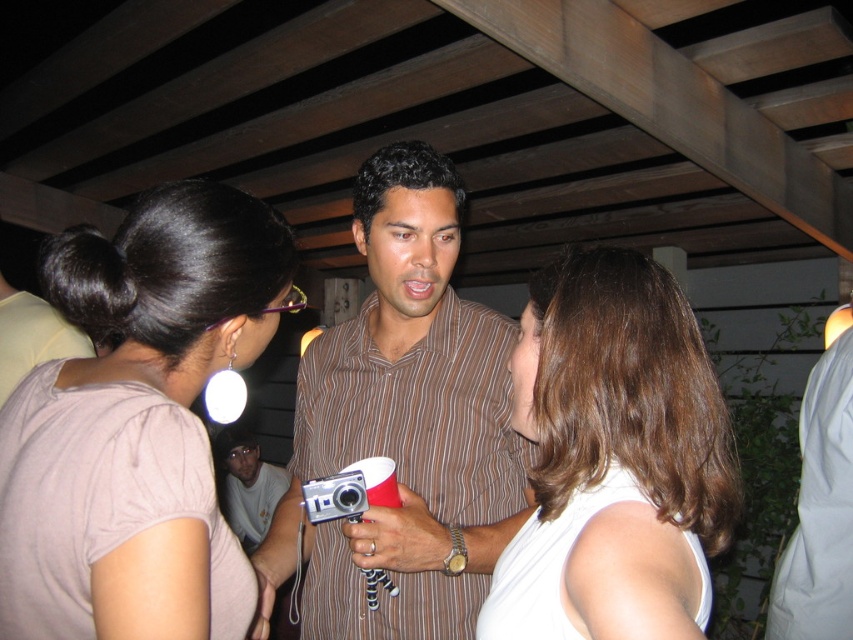
You are standing at the point labeled point (x=477, y=412) and want to move to the point labeled point (x=231, y=515). Given that you can only move in a straight line, will you be moving away from or towards the camera?

Since point (x=477, y=412) is closer to the camera than point (x=231, y=515), moving from point (x=477, y=412) to point (x=231, y=515) means you are moving away from the camera.

In the scene shown: You are at a party under a wooden pergola and notice two people wearing a brown striped shirt at center and a smooth white tank top at center. If you want to take a photo of both individuals, which one should you focus on first to ensure their faces are in the frame?

The brown striped shirt at center is taller than the smooth white tank top at center, so you should focus on the brown striped shirt at center first to ensure their face is visible in the frame since it is higher up.